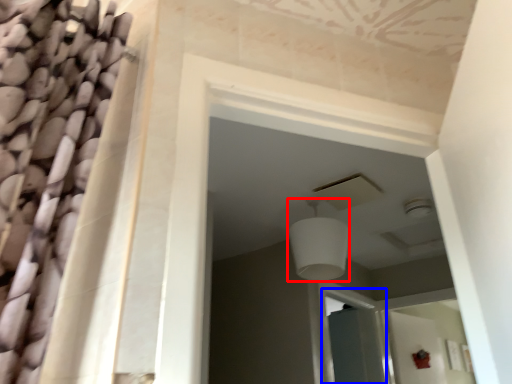
Question: Among these objects, which one is nearest to the camera, light fixture (highlighted by a red box) or screen door (highlighted by a blue box)?

Choices:
 (A) light fixture
 (B) screen door

Answer: (A)